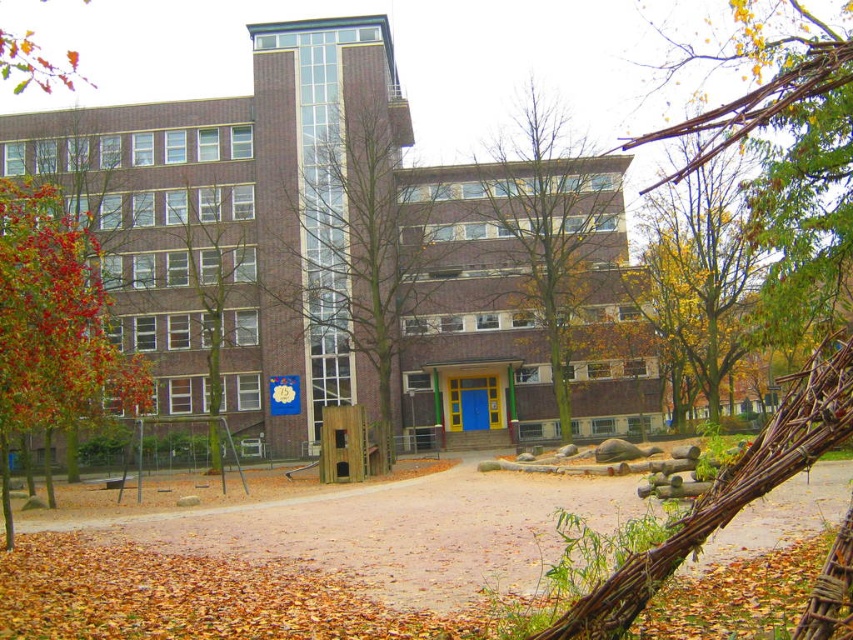
Is reddish-brown bark tree at left bigger than autumn leaves at upper left?

Indeed, reddish-brown bark tree at left has a larger size compared to autumn leaves at upper left.

Can you confirm if reddish-brown bark tree at left is positioned to the right of autumn leaves at upper left?

Correct, you'll find reddish-brown bark tree at left to the right of autumn leaves at upper left.

Is point (30, 337) less distant than point (70, 84)?

That is True.

Locate an element on the screen. reddish-brown bark tree at left is located at coordinates (54, 324).

Does brown leafy tree at center appear under green leafy tree at left?

Incorrect, brown leafy tree at center is not positioned below green leafy tree at left.

This screenshot has height=640, width=853. What are the coordinates of `brown leafy tree at center` in the screenshot? It's located at (553, 230).

Which is behind, point (585, 212) or point (207, 337)?

The point (207, 337) is behind.

Find the location of a particular element. brown leafy tree at center is located at coordinates click(x=553, y=230).

Is yellow-green leaves at upper center to the right of autumn leaves at upper left from the viewer's perspective?

Correct, you'll find yellow-green leaves at upper center to the right of autumn leaves at upper left.

Measure the distance between point [677,268] and camera.

The distance of point [677,268] from camera is 54.38 meters.

Find the location of a particular element. The height and width of the screenshot is (640, 853). yellow-green leaves at upper center is located at coordinates (700, 273).